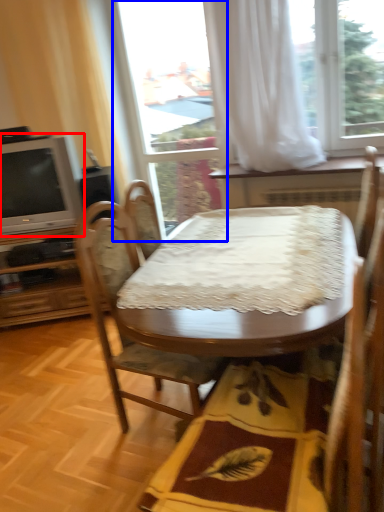
Question: Which point is further to the camera, television (highlighted by a red box) or glass door (highlighted by a blue box)?

Choices:
 (A) television
 (B) glass door

Answer: (B)